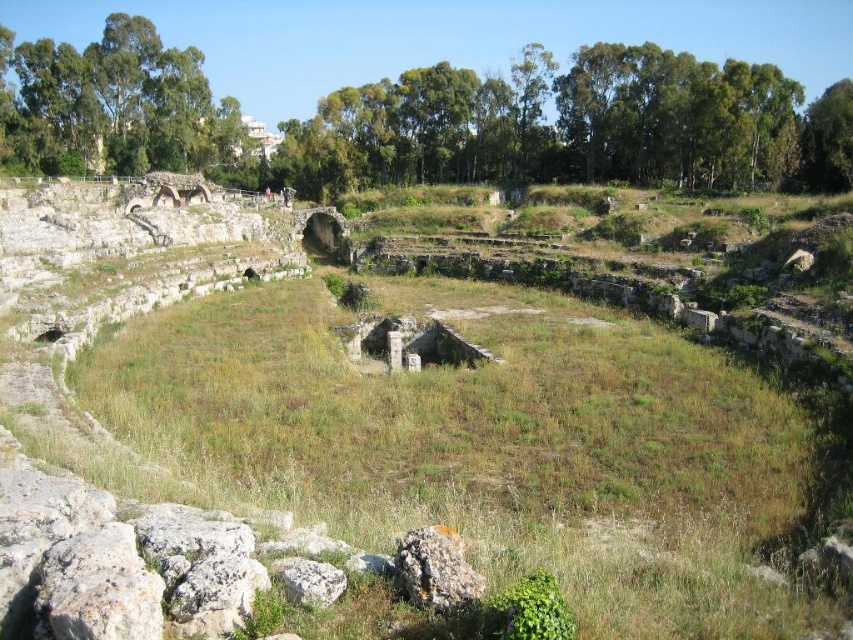
You are an archaeologist examining the ancient amphitheater ruins. You notice two features at the center of the arena area. Which one takes up more space there, the green grass at center or the white rough stone at center?

The green grass at center is bigger than the white rough stone at center, so it takes up more space there.

You are an archaeologist examining the ancient amphitheater ruins. You notice two objects at the center of the arena. Which object is wider, the rusty metallic rock at center or the white rough stone at center?

The rusty metallic rock at center is wider than the white rough stone at center according to the description.